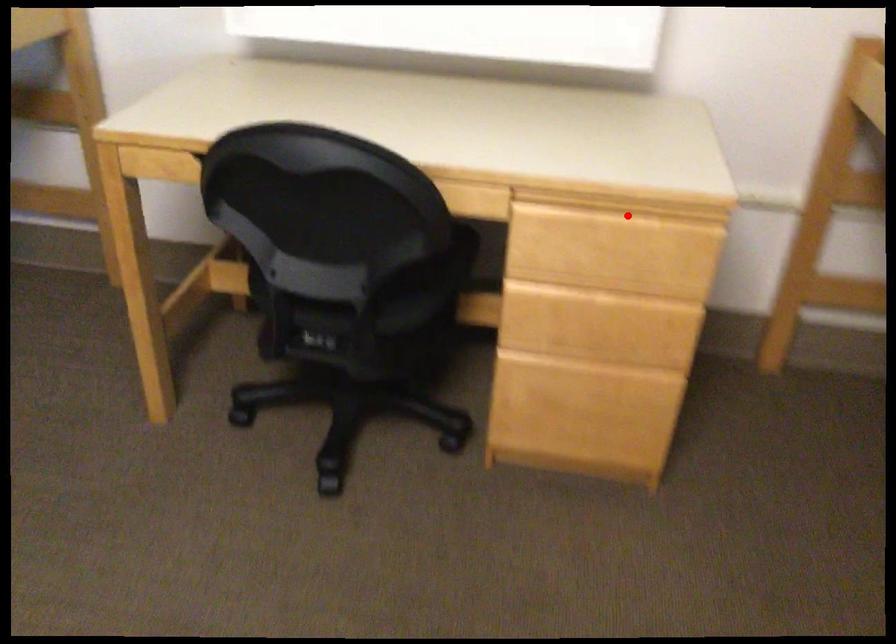
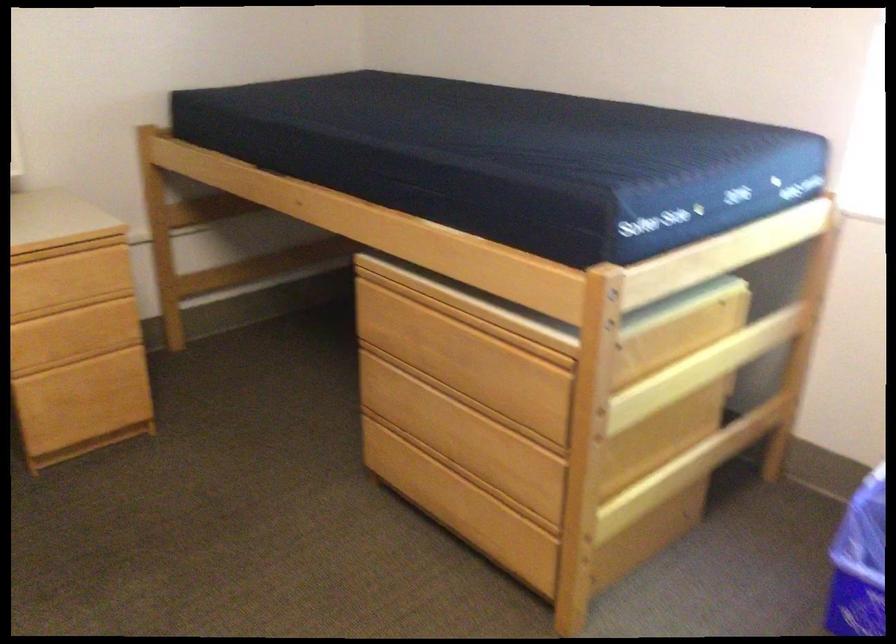
Question: I am providing you with two images of the same scene from different viewpoints. In image1, a red point is highlighted. Considering the same 3D point in image2, which of the following is correct?

Choices:
 (A) It is closer
 (B) It is farther

Answer: (B)